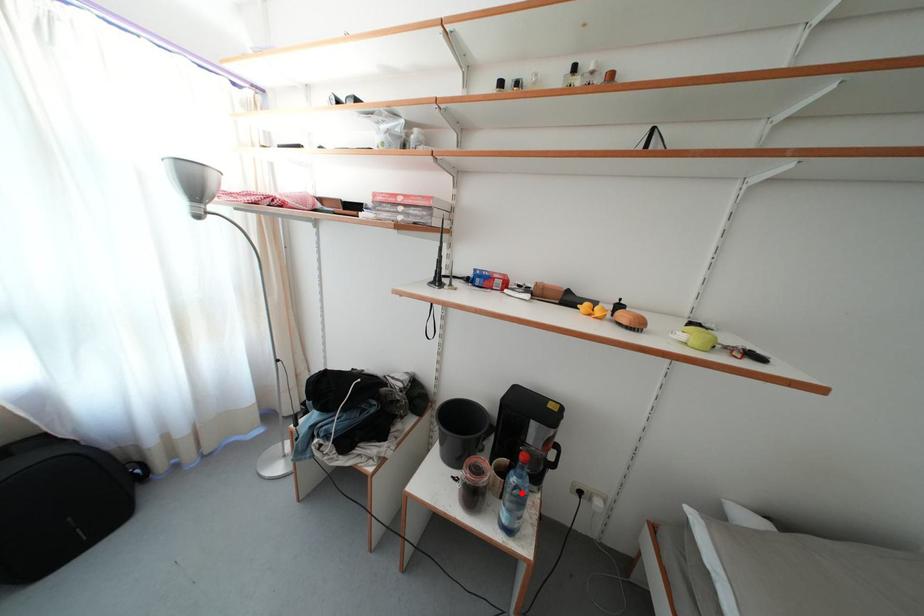
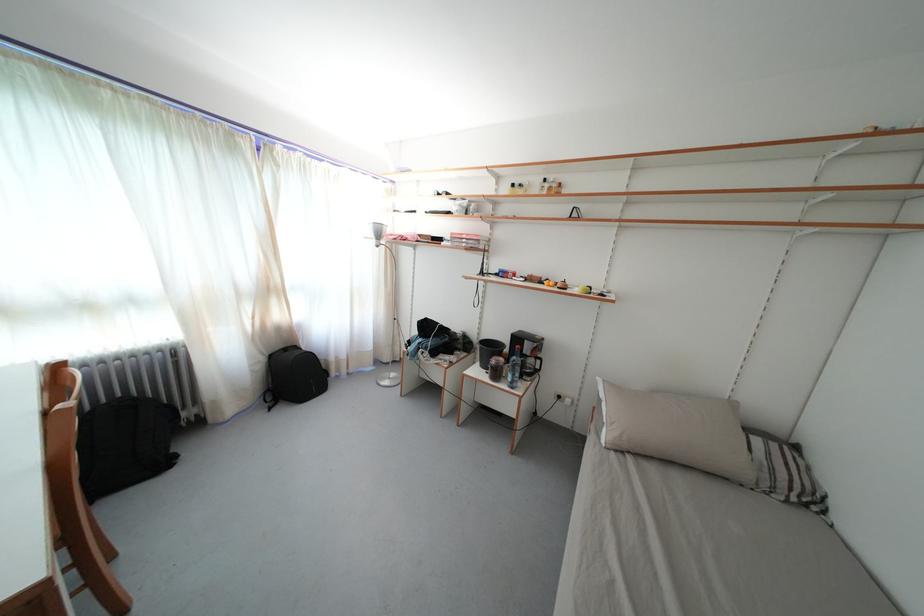
Question: I am providing you with two images of the same scene from different viewpoints. Image1 has a red point marked. In image2, the corresponding 3D location appears at what relative position? Reply with the corresponding letter.

Choices:
 (A) Closer
 (B) Farther

Answer: (B)